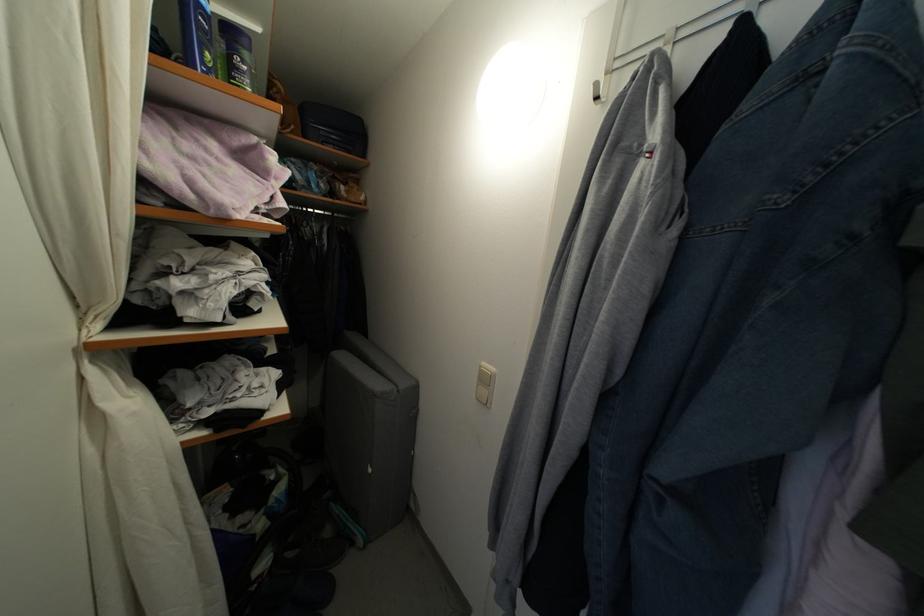
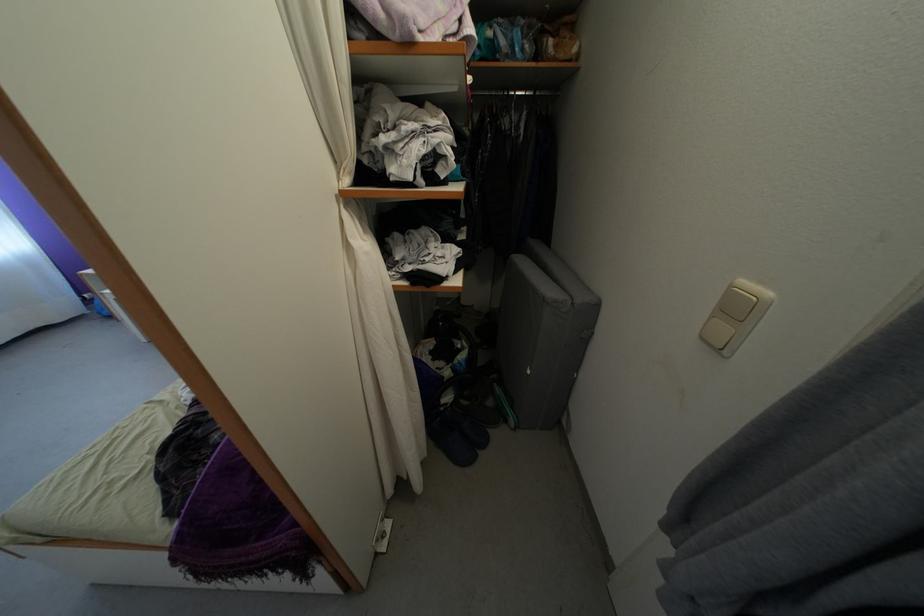
Locate, in the second image, the point that corresponds to [106,410] in the first image.

(356, 246)